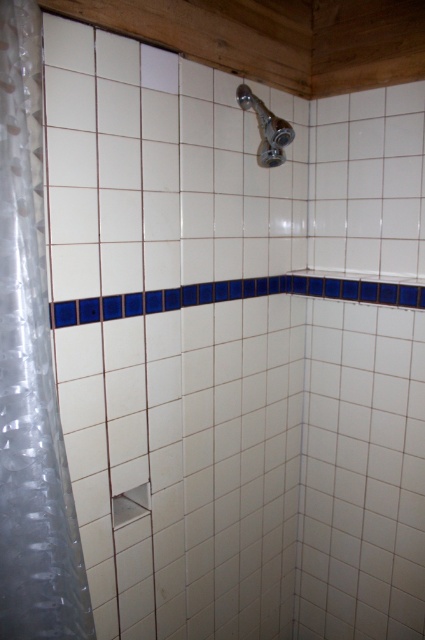
Question: Which point is closer to the camera taking this photo?

Choices:
 (A) (271, 132)
 (B) (22, 387)

Answer: (B)

Question: Which point is closer to the camera taking this photo?

Choices:
 (A) (28, 257)
 (B) (275, 145)

Answer: (A)

Question: In this image, where is clear plastic shower curtain at left located relative to satin chrome showerhead at upper center?

Choices:
 (A) below
 (B) above

Answer: (A)

Question: Which point appears closest to the camera in this image?

Choices:
 (A) (51, 438)
 (B) (277, 134)

Answer: (A)

Question: Does clear plastic shower curtain at left come behind satin chrome showerhead at upper center?

Choices:
 (A) no
 (B) yes

Answer: (A)

Question: Can you confirm if clear plastic shower curtain at left is smaller than satin chrome showerhead at upper center?

Choices:
 (A) no
 (B) yes

Answer: (A)